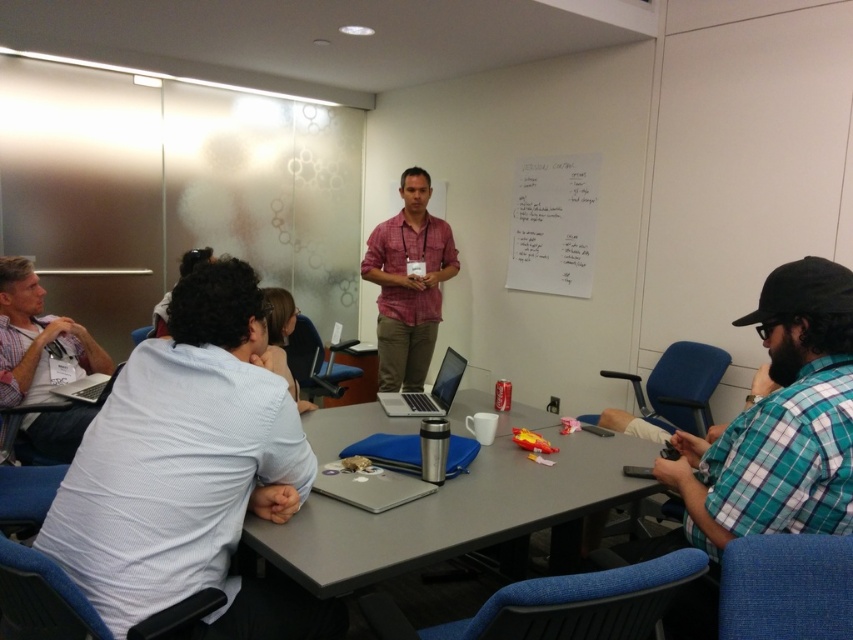
Which is in front, point (427, 342) or point (77, 344)?

Point (77, 344) is in front.

Based on the photo, does matte pink shirt at center have a greater height compared to matte white shirt at left?

Indeed, matte pink shirt at center has a greater height compared to matte white shirt at left.

Measure the distance between matte pink shirt at center and camera.

They are 4.02 meters apart.

At what (x,y) coordinates should I click in order to perform the action: click on matte pink shirt at center. Please return your answer as a coordinate pair (x, y). This screenshot has width=853, height=640. Looking at the image, I should click on (408, 284).

Who is lower down, white textured shirt at lower left or silver metallic laptop at center?

white textured shirt at lower left

Where is `white textured shirt at lower left`? white textured shirt at lower left is located at coordinates (189, 472).

Does point (229, 561) come closer to viewer compared to point (447, 385)?

That is True.

At what (x,y) coordinates should I click in order to perform the action: click on white textured shirt at lower left. Please return your answer as a coordinate pair (x, y). Looking at the image, I should click on (189, 472).

Is gray matte table at center closer to camera compared to matte pink shirt at center?

Yes, it is in front of matte pink shirt at center.

Which is more to the left, gray matte table at center or matte pink shirt at center?

From the viewer's perspective, matte pink shirt at center appears more on the left side.

Locate an element on the screen. This screenshot has width=853, height=640. gray matte table at center is located at coordinates (460, 509).

Find the location of a particular element. gray matte table at center is located at coordinates (460, 509).